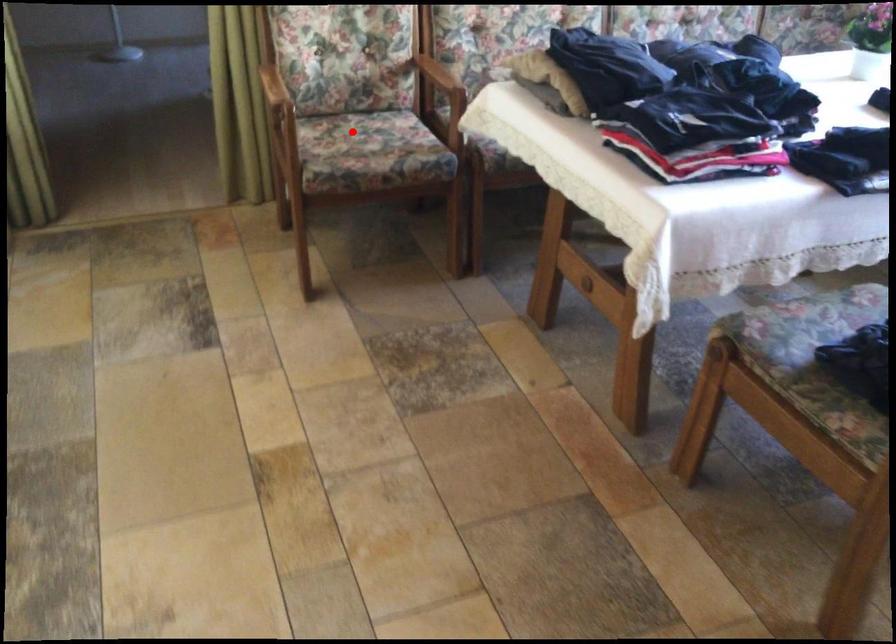
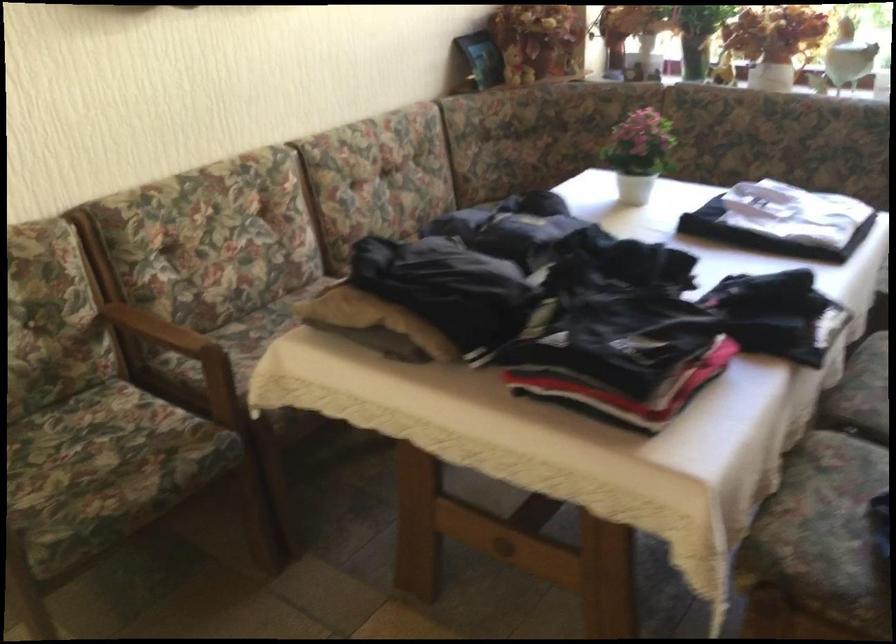
Question: I am providing you with two images of the same scene from different viewpoints. In image1, a red point is highlighted. Considering the same 3D point in image2, which of the following is correct?

Choices:
 (A) It is closer
 (B) It is farther

Answer: (A)